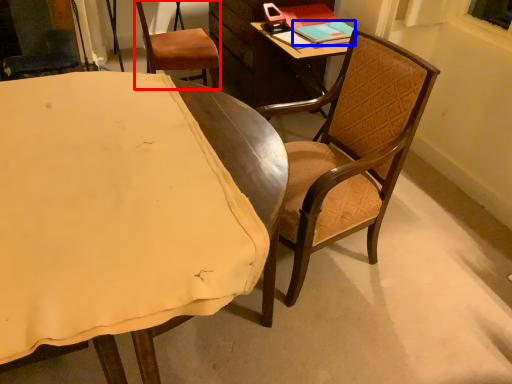
Question: Which object appears closest to the camera in this image, chair (highlighted by a red box) or book (highlighted by a blue box)?

Choices:
 (A) chair
 (B) book

Answer: (B)